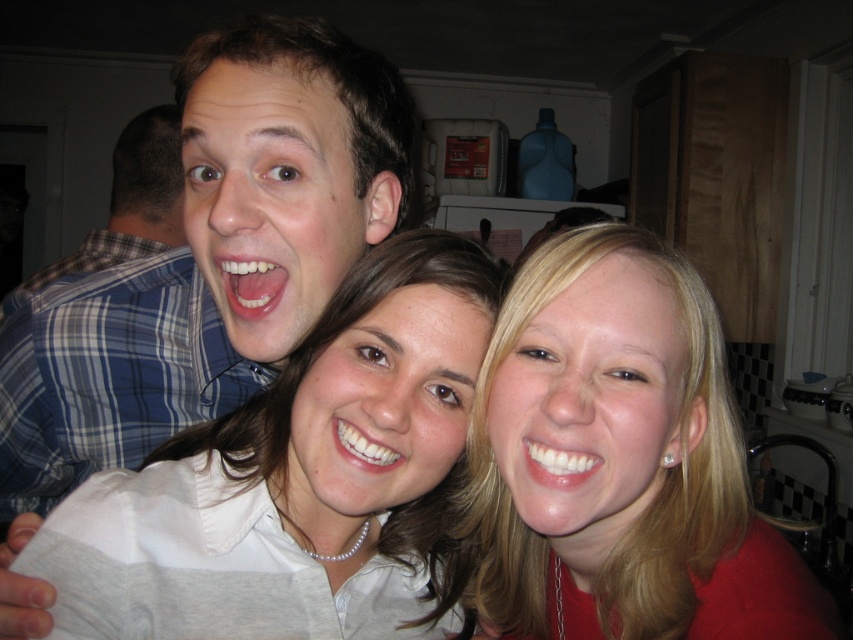
From the picture: You are a photographer trying to focus on both the white pearl necklace at center and the blue plaid shirt at left. Which object is closer to the right edge of the frame?

The white pearl necklace at center is positioned on the right side of the blue plaid shirt at left, so it is closer to the right edge of the frame.

You are taking a photo of the scene and want to ensure both the white matte shirt at upper left and the white pearl necklace at center are clearly visible. Which object should you focus on first to ensure proper focus, considering their positions?

The white matte shirt at upper left is located above the white pearl necklace at center, so focusing on the white pearl necklace at center first would ensure it is in clear focus since it is closer to the camera.

You are a photographer trying to focus on the white pearl necklace at center while capturing the group photo. Considering the white matte shirt at upper left is larger in size, will the necklace be easily visible in the final photo?

The white pearl necklace at center will be visible because although the white matte shirt at upper left is larger, the necklace is positioned at the center and not obstructed by the shirt.